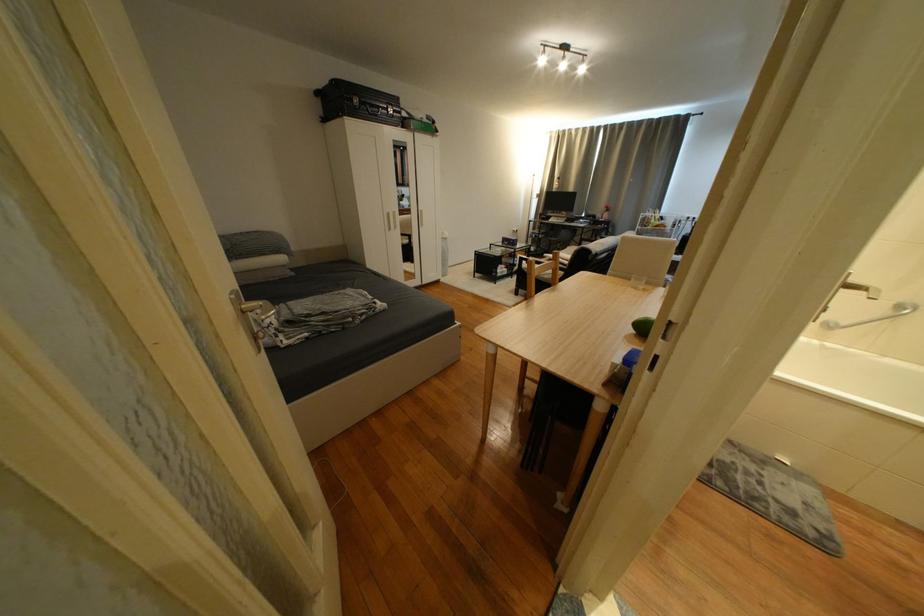
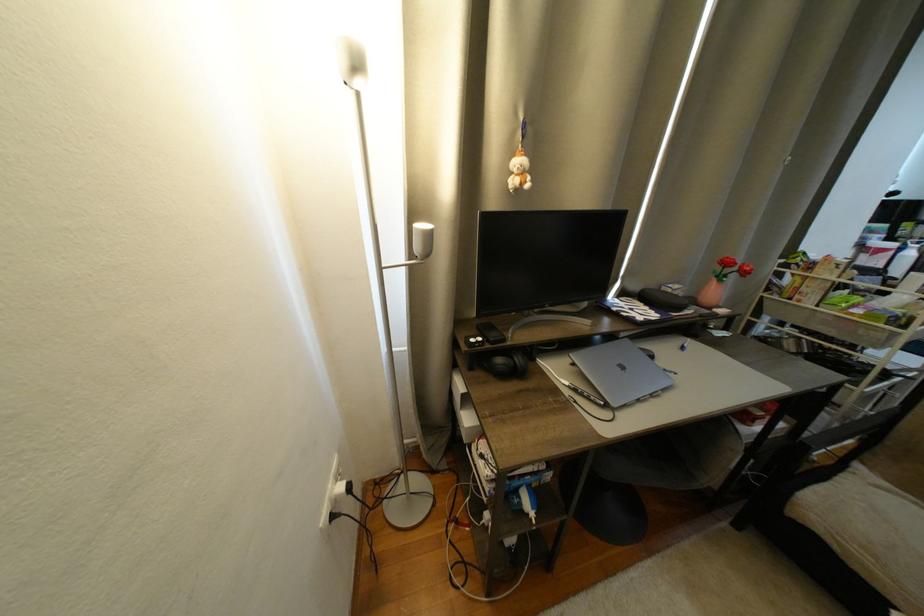
Where in the second image is the point corresponding to (x=521, y=231) from the first image?

(333, 520)